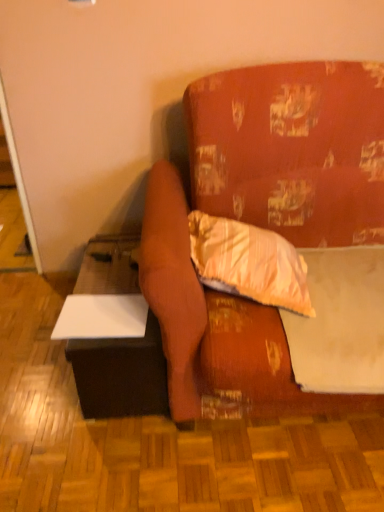
Question: Considering the positions of textured orange couch at center and white matte sheet at upper right in the image, is textured orange couch at center wider or thinner than white matte sheet at upper right?

Choices:
 (A) thin
 (B) wide

Answer: (B)

Question: Is point (288, 236) closer or farther from the camera than point (372, 248)?

Choices:
 (A) closer
 (B) farther

Answer: (B)

Question: Which object is positioned closest to the striped fabric pillow at center?

Choices:
 (A) white matte table at lower left
 (B) white matte sheet at upper right
 (C) textured orange couch at center

Answer: (B)

Question: Based on their relative distances, which object is nearer to the textured orange couch at center?

Choices:
 (A) white matte table at lower left
 (B) striped fabric pillow at center
 (C) white matte sheet at upper right

Answer: (B)